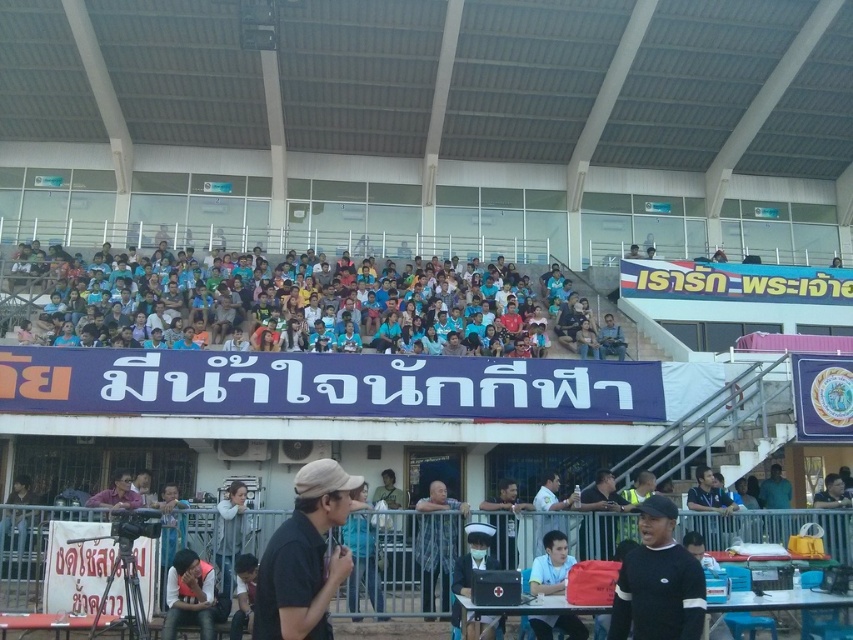
Which is below, dark gray uniform at center or matte black jacket at lower left?

Positioned lower is matte black jacket at lower left.

Which is behind, point (436, 518) or point (172, 580)?

The point (436, 518) is behind.

Identify the location of dark gray uniform at center. Image resolution: width=853 pixels, height=640 pixels. (437, 541).

Based on the photo, which is more to the right, matte black cap at center or white matte shirt at center?

white matte shirt at center is more to the right.

Does matte black cap at center have a lesser height compared to white matte shirt at center?

No.

Which is behind, point (316, 604) or point (540, 484)?

The point (540, 484) is behind.

Identify the location of matte black cap at center. The image size is (853, 640). tap(305, 557).

How much distance is there between black matte cap at lower center and dark gray uniform at center?

black matte cap at lower center is 10.60 meters from dark gray uniform at center.

The height and width of the screenshot is (640, 853). In order to click on black matte cap at lower center in this screenshot , I will do `click(659, 580)`.

Is point (640, 616) closer to camera compared to point (445, 516)?

That is True.

At what (x,y) coordinates should I click in order to perform the action: click on black matte cap at lower center. Please return your answer as a coordinate pair (x, y). This screenshot has height=640, width=853. Looking at the image, I should click on (659, 580).